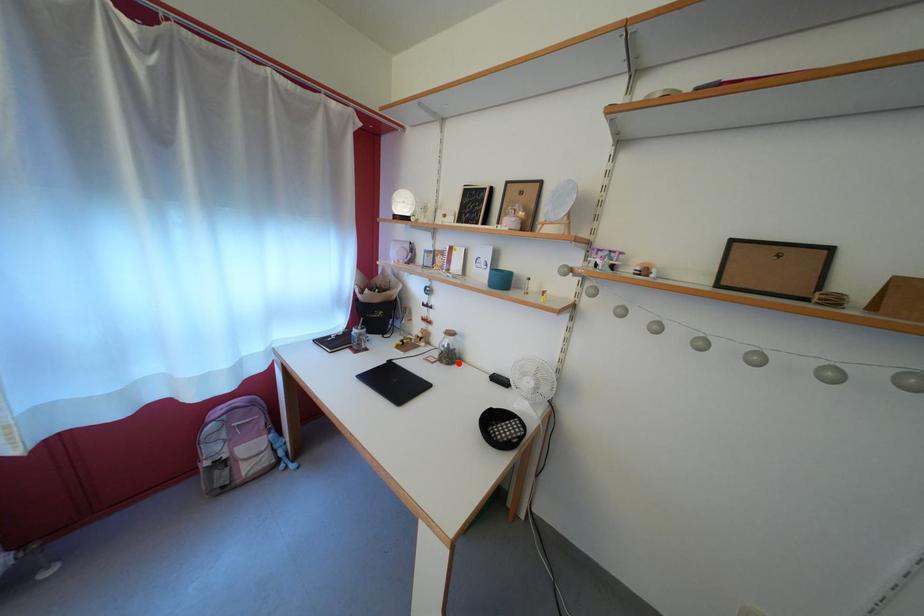
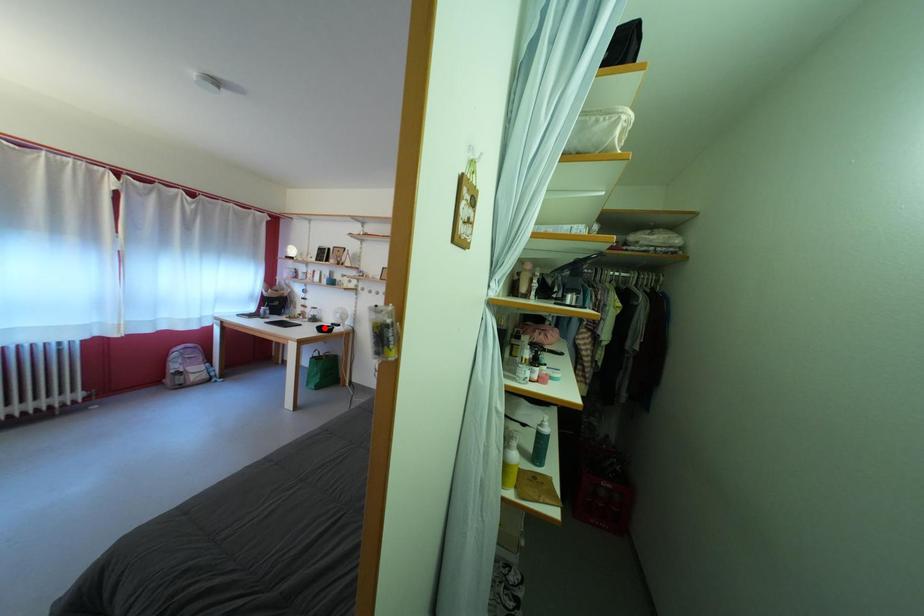
Consider the image. I am providing you with two images of the same scene from different viewpoints. A red point is marked on the first image and another point is marked on the second image. Is the marked point in image1 the same physical position as the marked point in image2?

No